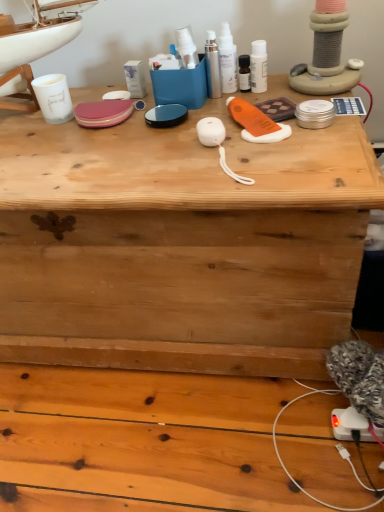
Question: From a real-world perspective, is white glossy spray bottles at upper center, arranged as the 2th toiletry when viewed from the left, physically located above or below sleek silver spray at center, the 1th toiletry viewed from the left?

Choices:
 (A) above
 (B) below

Answer: (A)

Question: From the image's perspective, is white glossy spray bottles at upper center, acting as the second toiletry starting from the right, positioned above or below sleek silver spray at center, arranged as the third toiletry when viewed from the right?

Choices:
 (A) below
 (B) above

Answer: (B)

Question: Which of these objects is positioned closest to the sleek silver spray at center, arranged as the third toiletry when viewed from the right?

Choices:
 (A) white glossy spray bottles at upper center, arranged as the 2th toiletry when viewed from the left
 (B) white glossy lotion at upper center, which is counted as the 3th toiletry, starting from the left

Answer: (A)

Question: Which object is positioned farthest from the white glossy lotion at upper center, which is counted as the 3th toiletry, starting from the left?

Choices:
 (A) sleek silver spray at center, arranged as the third toiletry when viewed from the right
 (B) white glossy spray bottles at upper center, acting as the second toiletry starting from the right

Answer: (A)